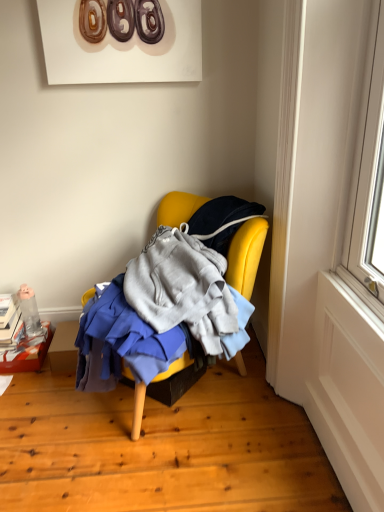
Question: Looking at their shapes, would you say cardboard box at lower left is wider or thinner than yellow fabric chair at center?

Choices:
 (A) wide
 (B) thin

Answer: (B)

Question: Is cardboard box at lower left bigger or smaller than yellow fabric chair at center?

Choices:
 (A) small
 (B) big

Answer: (A)

Question: Based on their relative distances, which object is nearer to the cardboard box at lower left?

Choices:
 (A) translucent plastic bottle at lower left
 (B) yellow fabric chair at center

Answer: (A)

Question: Which is nearer to the translucent plastic bottle at lower left?

Choices:
 (A) yellow fabric chair at center
 (B) cardboard box at lower left

Answer: (B)